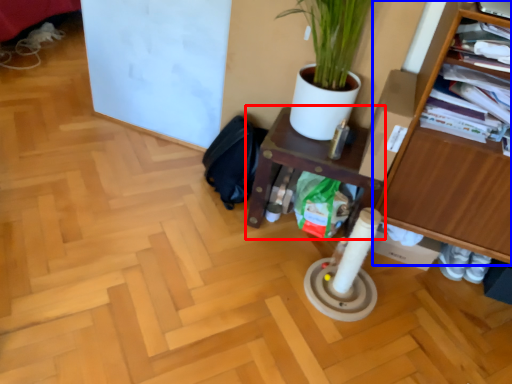
Question: Which object is closer to the camera taking this photo, shelf (highlighted by a red box) or furniture (highlighted by a blue box)?

Choices:
 (A) shelf
 (B) furniture

Answer: (B)